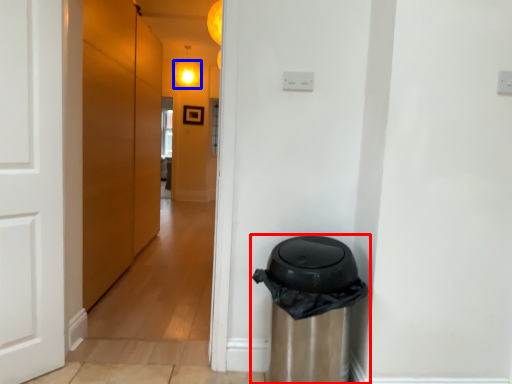
Question: Which object appears farthest to the camera in this image, waste container (highlighted by a red box) or light (highlighted by a blue box)?

Choices:
 (A) waste container
 (B) light

Answer: (B)